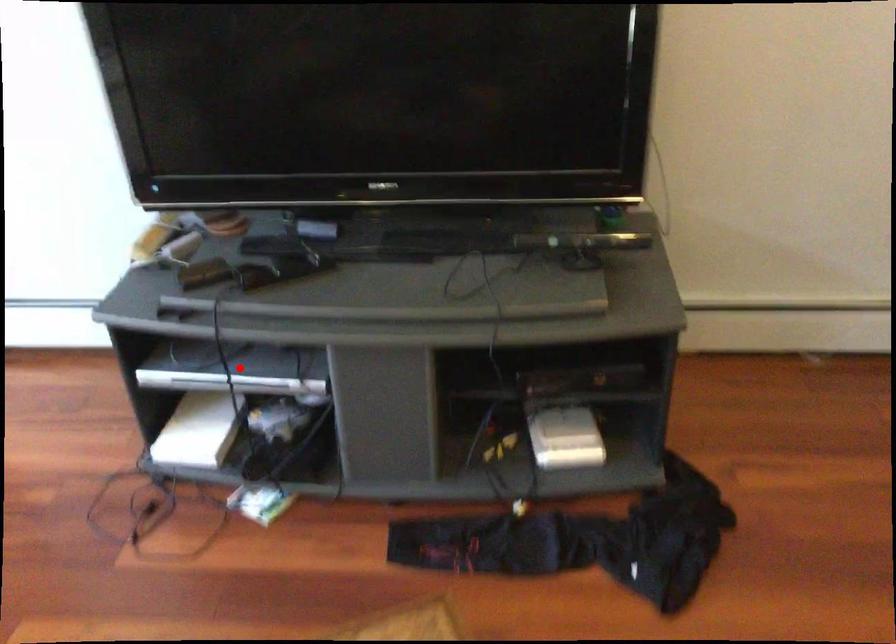
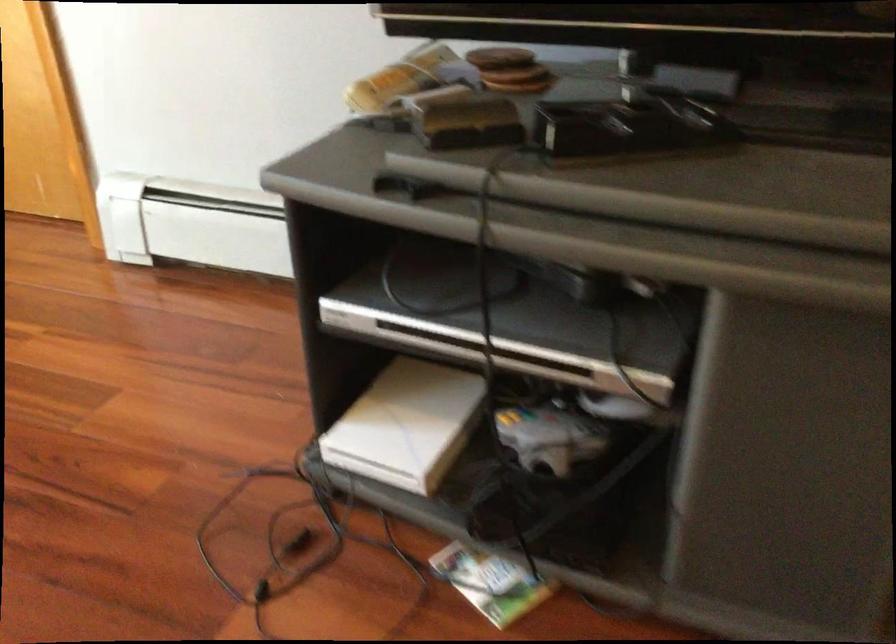
Question: I am providing you with two images of the same scene from different viewpoints. In image1, a red point is highlighted. Considering the same 3D point in image2, which of the following is correct?

Choices:
 (A) It is closer
 (B) It is farther

Answer: (A)